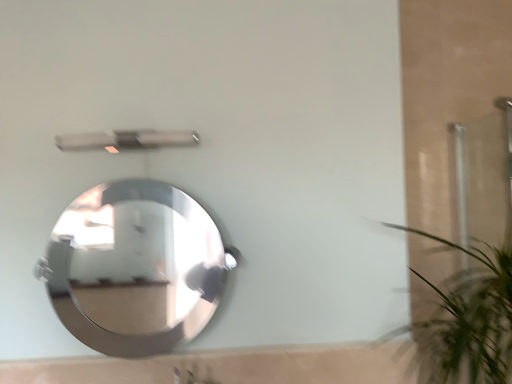
The image size is (512, 384). Describe the element at coordinates (127, 140) in the screenshot. I see `metallic silver shower at upper center` at that location.

What is the approximate width of metallic silver shower at upper center?

metallic silver shower at upper center is 3.03 inches wide.

Image resolution: width=512 pixels, height=384 pixels. I want to click on green leafy plant at right, so click(469, 317).

Image resolution: width=512 pixels, height=384 pixels. I want to click on polished silver mirror at center, so click(x=133, y=254).

Locate an element on the screen. This screenshot has width=512, height=384. metallic silver shower at upper center is located at coordinates (127, 140).

Is green leafy plant at right completely or partially inside metallic silver shower at upper center?

No, green leafy plant at right is located outside of metallic silver shower at upper center.

From the image's perspective, who appears lower, metallic silver shower at upper center or green leafy plant at right?

green leafy plant at right, from the image's perspective.

From a real-world perspective, which is physically above, metallic silver shower at upper center or green leafy plant at right?

metallic silver shower at upper center.

Is the surface of metallic silver shower at upper center in direct contact with green leafy plant at right?

metallic silver shower at upper center and green leafy plant at right are clearly separated.

Locate an element on the screen. The image size is (512, 384). houseplant below the metallic silver shower at upper center (from a real-world perspective) is located at coordinates (469, 317).

Is green leafy plant at right behind metallic silver shower at upper center?

No, the depth of green leafy plant at right is less than that of metallic silver shower at upper center.

Does green leafy plant at right have a lesser height compared to metallic silver shower at upper center?

No.

In the scene shown: Does polished silver mirror at center have a greater height compared to green leafy plant at right?

No, polished silver mirror at center is not taller than green leafy plant at right.

Is polished silver mirror at center wider than green leafy plant at right?

No.

Does polished silver mirror at center have a larger size compared to green leafy plant at right?

No.

Is polished silver mirror at center not close to green leafy plant at right?

Indeed, polished silver mirror at center is not near green leafy plant at right.

Is metallic silver shower at upper center not near polished silver mirror at center?

metallic silver shower at upper center is far away from polished silver mirror at center.

Consider the image. Between metallic silver shower at upper center and polished silver mirror at center, which one appears on the left side from the viewer's perspective?

Positioned to the left is metallic silver shower at upper center.

Is point (114, 138) farther from viewer compared to point (94, 219)?

No, it is not.

Where is `shower behind the polished silver mirror at center`? Image resolution: width=512 pixels, height=384 pixels. shower behind the polished silver mirror at center is located at coordinates (127, 140).

Which object is wider, polished silver mirror at center or metallic silver shower at upper center?

polished silver mirror at center.

Between polished silver mirror at center and metallic silver shower at upper center, which one appears on the right side from the viewer's perspective?

From the viewer's perspective, polished silver mirror at center appears more on the right side.

Can you tell me how much polished silver mirror at center and metallic silver shower at upper center differ in facing direction?

0.662 degrees.

How far apart are polished silver mirror at center and metallic silver shower at upper center?

polished silver mirror at center and metallic silver shower at upper center are 2.52 meters apart from each other.

Does green leafy plant at right appear on the left side of polished silver mirror at center?

No, green leafy plant at right is not to the left of polished silver mirror at center.

How many degrees apart are the facing directions of green leafy plant at right and polished silver mirror at center?

green leafy plant at right and polished silver mirror at center are facing 2.19 degrees away from each other.

Is green leafy plant at right inside or outside of polished silver mirror at center?

green leafy plant at right lies outside polished silver mirror at center.

The height and width of the screenshot is (384, 512). Identify the location of shower positioned vertically above the green leafy plant at right (from a real-world perspective). (127, 140).

The height and width of the screenshot is (384, 512). Find the location of `shower that is on the left side of green leafy plant at right`. shower that is on the left side of green leafy plant at right is located at coordinates (127, 140).

From the image, which object appears to be nearer to metallic silver shower at upper center, polished silver mirror at center or green leafy plant at right?

The object closer to metallic silver shower at upper center is green leafy plant at right.

Which object lies nearer to the anchor point green leafy plant at right, metallic silver shower at upper center or polished silver mirror at center?

Based on the image, metallic silver shower at upper center appears to be nearer to green leafy plant at right.

Which object lies nearer to the anchor point green leafy plant at right, polished silver mirror at center or metallic silver shower at upper center?

metallic silver shower at upper center is closer to green leafy plant at right.

Based on their spatial positions, is green leafy plant at right or metallic silver shower at upper center closer to polished silver mirror at center?

metallic silver shower at upper center is positioned closer to the anchor polished silver mirror at center.

Looking at the image, which one is located further to polished silver mirror at center, metallic silver shower at upper center or green leafy plant at right?

green leafy plant at right is further to polished silver mirror at center.

Looking at the image, which one is located closer to metallic silver shower at upper center, green leafy plant at right or polished silver mirror at center?

green leafy plant at right is closer to metallic silver shower at upper center.

This screenshot has height=384, width=512. In order to click on mirror between metallic silver shower at upper center and green leafy plant at right in the horizontal direction in this screenshot , I will do `click(133, 254)`.